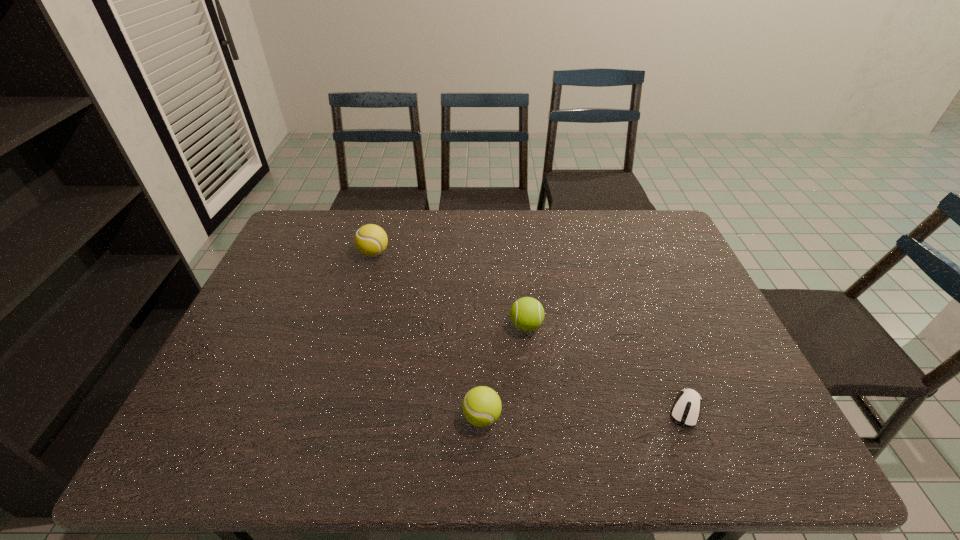
Locate an element on the screen. This screenshot has height=540, width=960. vacant area situated on the right of the nearest tennis ball is located at coordinates (652, 417).

Identify the location of vacant space located 0.350m on the left of the rightmost object. This screenshot has height=540, width=960. (515, 409).

Image resolution: width=960 pixels, height=540 pixels. What are the coordinates of `object that is at the far edge` in the screenshot? It's located at (371, 240).

Locate an element on the screen. The height and width of the screenshot is (540, 960). tennis ball at the near edge is located at coordinates (481, 406).

The width and height of the screenshot is (960, 540). In order to click on mouse that is at the near edge in this screenshot , I will do `click(686, 409)`.

Identify the location of object present at the right edge. (686, 409).

The height and width of the screenshot is (540, 960). Identify the location of object located in the near right corner section of the desktop. (686, 409).

Image resolution: width=960 pixels, height=540 pixels. I want to click on blank space at the far edge of the desktop, so click(x=431, y=247).

Locate an element on the screen. This screenshot has height=540, width=960. free space at the near edge is located at coordinates (350, 442).

Identify the location of blank space at the left edge of the desktop. (246, 428).